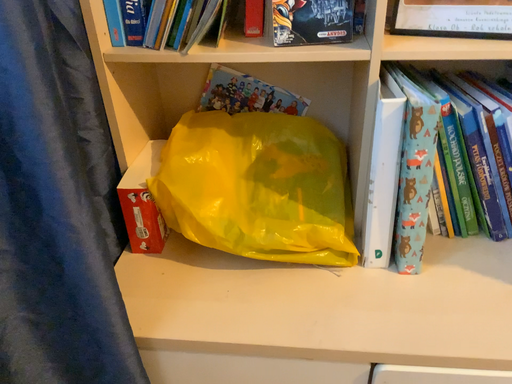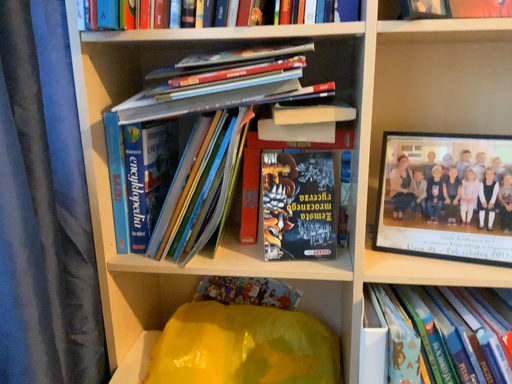
Question: How did the camera likely rotate when shooting the video?

Choices:
 (A) rotated upward
 (B) rotated downward

Answer: (A)